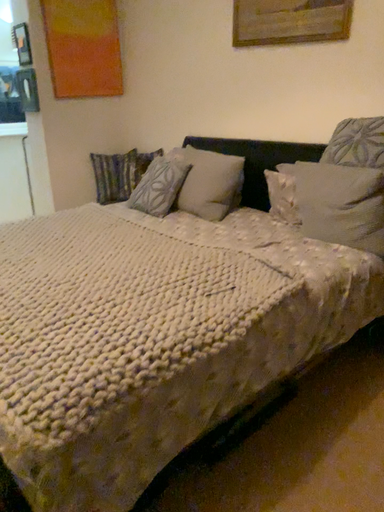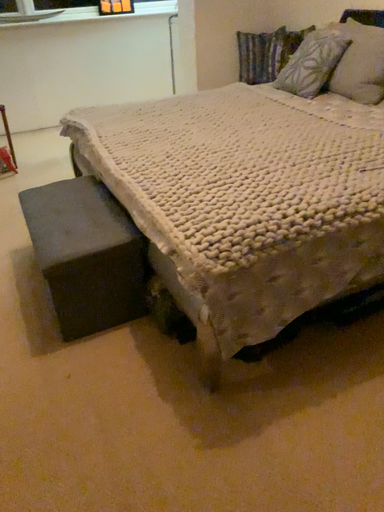
Question: Which way did the camera rotate in the video?

Choices:
 (A) rotated left
 (B) rotated right

Answer: (A)